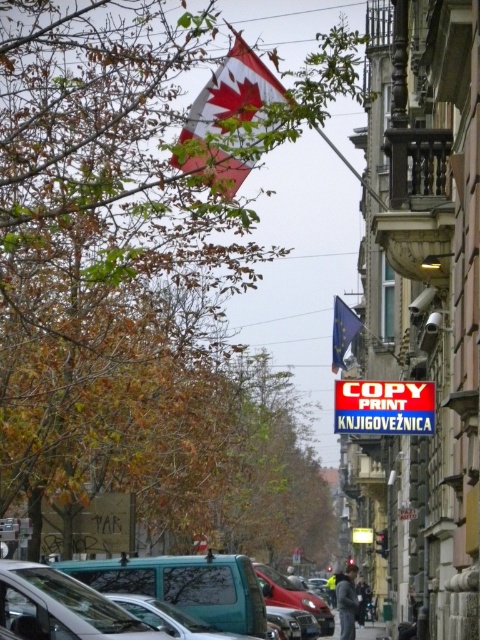
Is matte red car at center above dark gray jacket at center?

Yes, matte red car at center is above dark gray jacket at center.

Consider the image. Does matte red car at center appear under dark gray jacket at center?

No.

Where is `matte red car at center`? This screenshot has width=480, height=640. matte red car at center is located at coordinates (292, 596).

At what (x,y) coordinates should I click in order to perform the action: click on matte red car at center. Please return your answer as a coordinate pair (x, y). Looking at the image, I should click on (292, 596).

Which is behind, point (13, 612) or point (336, 352)?

The point (336, 352) is behind.

In order to click on teal matte van at center in this screenshot , I will do [x=187, y=586].

Who is more forward, (231,564) or (335,305)?

Positioned in front is point (231,564).

The image size is (480, 640). Find the location of `teal matte van at center`. teal matte van at center is located at coordinates (187, 586).

Consider the image. Who is shorter, teal matte van at center or red and white fabric flag at upper center?

red and white fabric flag at upper center is shorter.

Identify the location of teal matte van at center. (187, 586).

Identify the location of teal matte van at center. (187, 586).